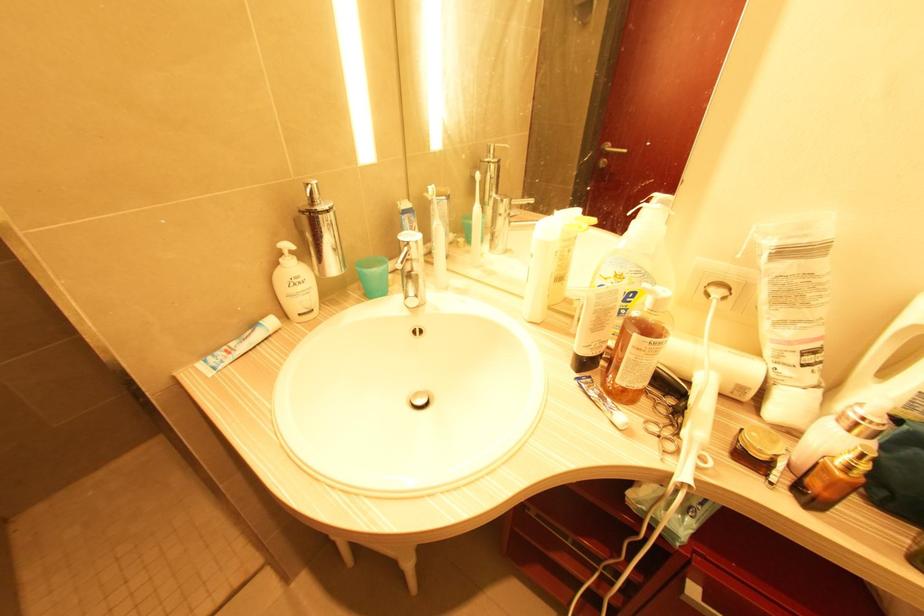
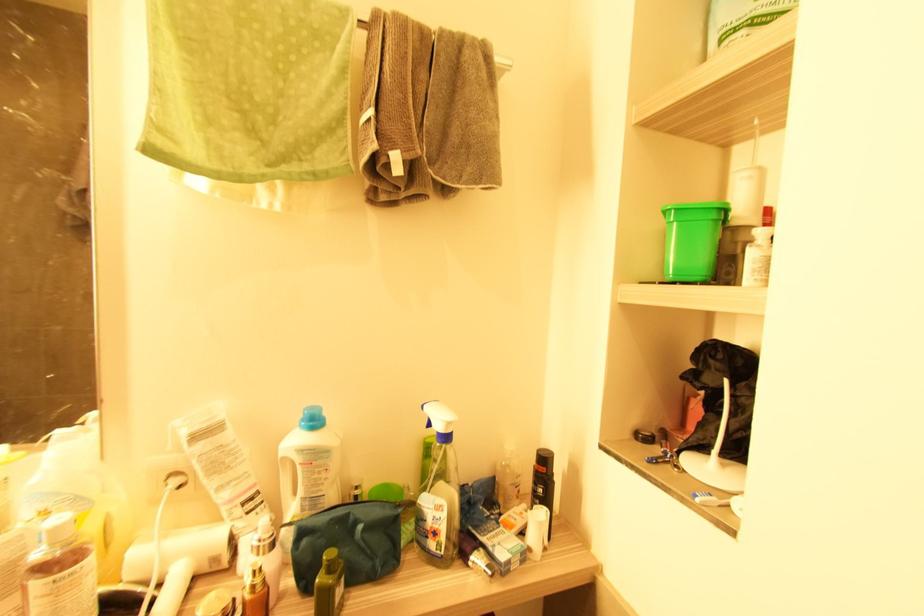
Find the pixel in the second image that matches (x=743, y=390) in the first image.

(216, 561)